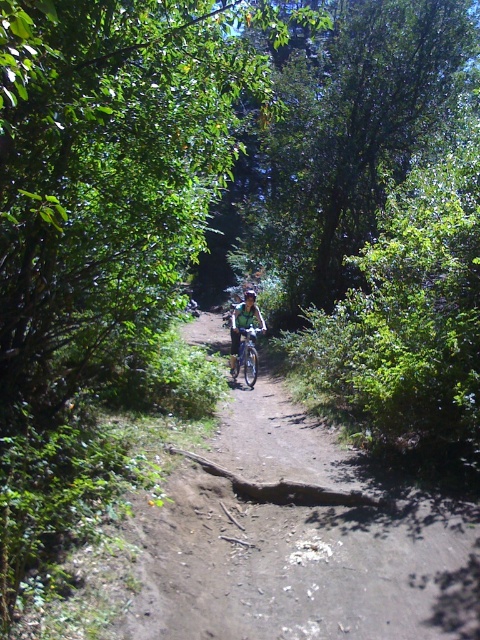
Question: Where is green leafy tree at center located in relation to green matte bicycle at center in the image?

Choices:
 (A) below
 (B) above

Answer: (B)

Question: Can you confirm if green leafy tree at center is positioned to the right of shiny silver mountain bike at center?

Choices:
 (A) yes
 (B) no

Answer: (A)

Question: Can you confirm if green leafy tree at center is smaller than shiny silver mountain bike at center?

Choices:
 (A) yes
 (B) no

Answer: (B)

Question: Considering the real-world distances, which object is closest to the shiny silver mountain bike at center?

Choices:
 (A) green matte bicycle at center
 (B) green leafy tree at center

Answer: (A)

Question: Which of these objects is positioned farthest from the dirt path at center?

Choices:
 (A) green leafy tree at center
 (B) shiny silver mountain bike at center
 (C) green matte bicycle at center

Answer: (A)

Question: Which is nearer to the green matte bicycle at center?

Choices:
 (A) green leafy tree at center
 (B) dirt path at center

Answer: (A)